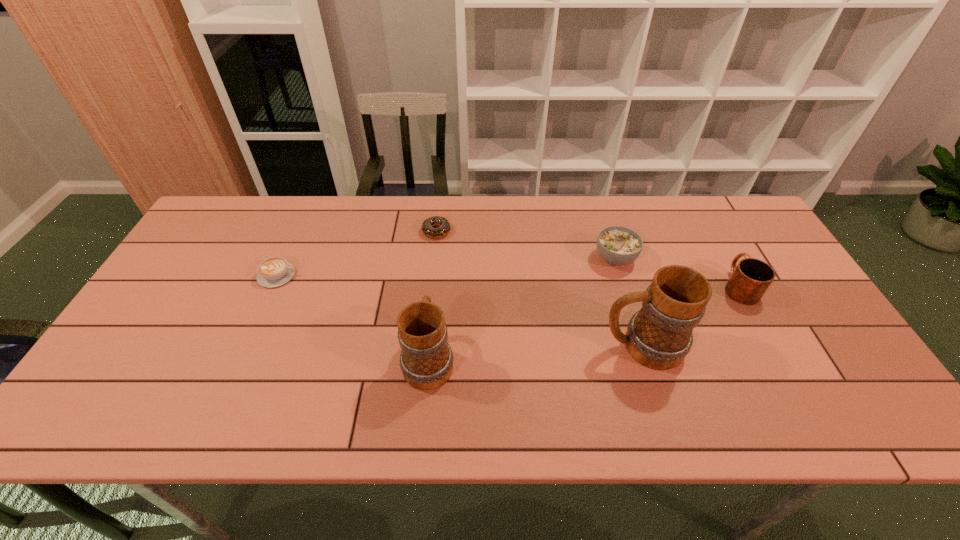
The height and width of the screenshot is (540, 960). What are the coordinates of `the leftmost object` in the screenshot? It's located at (275, 271).

You are a GUI agent. You are given a task and a screenshot of the screen. Output one action in this format:
    pyautogui.click(x=<x>, y=<y>)
    Task: Click on the free space located on the side of the second tallest mug with the handle
    This screenshot has width=960, height=540.
    Given the screenshot: What is the action you would take?
    pyautogui.click(x=441, y=237)

You are a GUI agent. You are given a task and a screenshot of the screen. Output one action in this format:
    pyautogui.click(x=<x>, y=<y>)
    Task: Click on the vacant space located on the side of the second tallest mug with the handle
    This screenshot has height=540, width=960.
    Given the screenshot: What is the action you would take?
    pyautogui.click(x=436, y=282)

This screenshot has width=960, height=540. I want to click on free point located on the side of the second tallest mug with the handle, so click(433, 315).

The image size is (960, 540). What are the coordinates of `blank space located on the side of the second mug from left to right with the handle` in the screenshot? It's located at (522, 346).

This screenshot has width=960, height=540. Find the location of `free region located on the side of the second mug from left to right with the handle`. free region located on the side of the second mug from left to right with the handle is located at coordinates (515, 346).

Where is `vacant space located on the side of the second mug from left to right with the handle`? vacant space located on the side of the second mug from left to right with the handle is located at coordinates (566, 346).

Image resolution: width=960 pixels, height=540 pixels. Find the location of `free location located 0.260m on the left of the shortest object`. free location located 0.260m on the left of the shortest object is located at coordinates (340, 231).

The image size is (960, 540). I want to click on vacant point located 0.360m on the right of the fourth tallest object, so click(758, 258).

Identify the location of free region located 0.340m on the side of the rightmost mug with the handle. (690, 199).